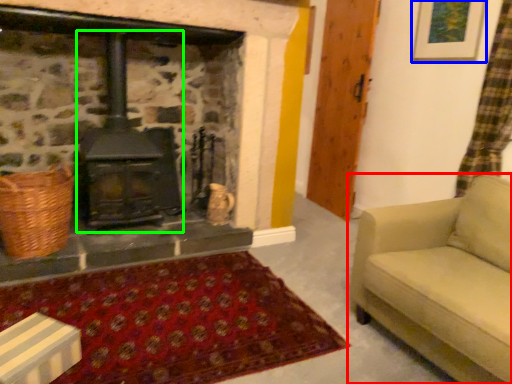
Question: Based on their relative distances, which object is farther from studio couch (highlighted by a red box)? Choose from picture frame (highlighted by a blue box) and wood burning stove (highlighted by a green box).

Choices:
 (A) picture frame
 (B) wood burning stove

Answer: (B)